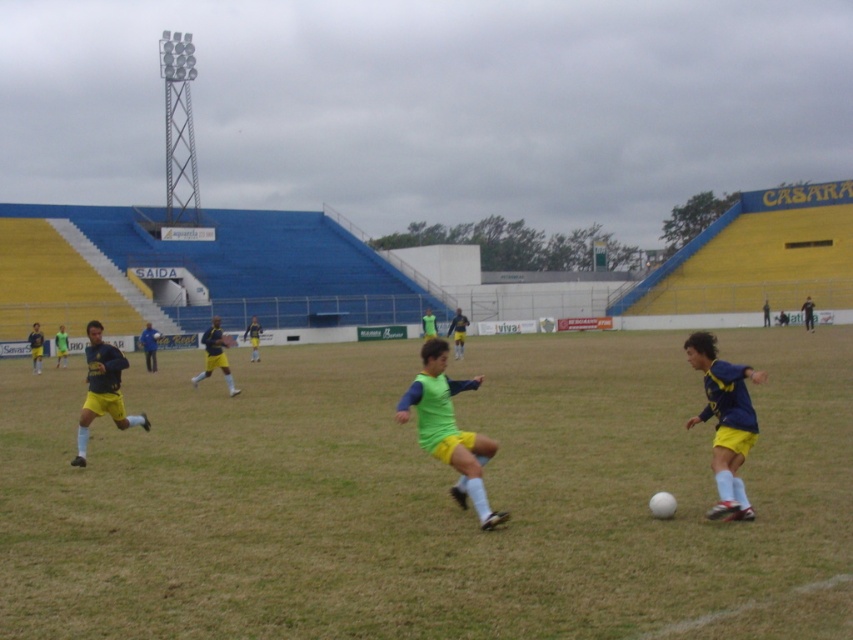
Does green grass at center have a greater width compared to blue jersey at center?

Yes, green grass at center is wider than blue jersey at center.

Who is taller, green grass at center or blue jersey at center?

Standing taller between the two is blue jersey at center.

What do you see at coordinates (428, 497) in the screenshot?
I see `green grass at center` at bounding box center [428, 497].

Identify the location of green grass at center. (428, 497).

Between yellow jersey at left and yellow jersey at center, which one has less height?

yellow jersey at left is shorter.

Who is more forward, (114, 362) or (213, 352)?

Point (114, 362) is more forward.

Locate an element on the screen. The image size is (853, 640). yellow jersey at left is located at coordinates (102, 388).

Is blue jersey at center below yellow jersey at center?

Yes.

Does blue jersey at center have a larger size compared to yellow jersey at center?

No.

Between point (714, 470) and point (212, 360), which one is positioned behind?

The point (212, 360) is more distant.

Where is `blue jersey at center`? This screenshot has height=640, width=853. blue jersey at center is located at coordinates (724, 420).